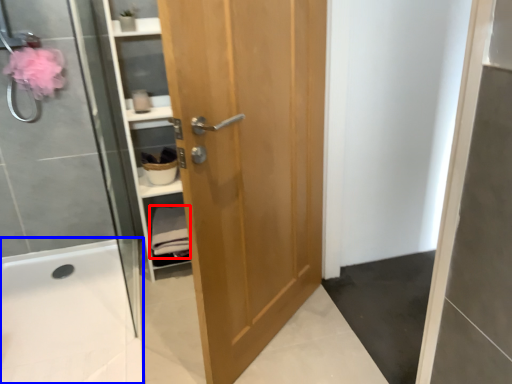
Question: Which object appears closest to the camera in this image, material (highlighted by a red box) or bath (highlighted by a blue box)?

Choices:
 (A) material
 (B) bath

Answer: (B)